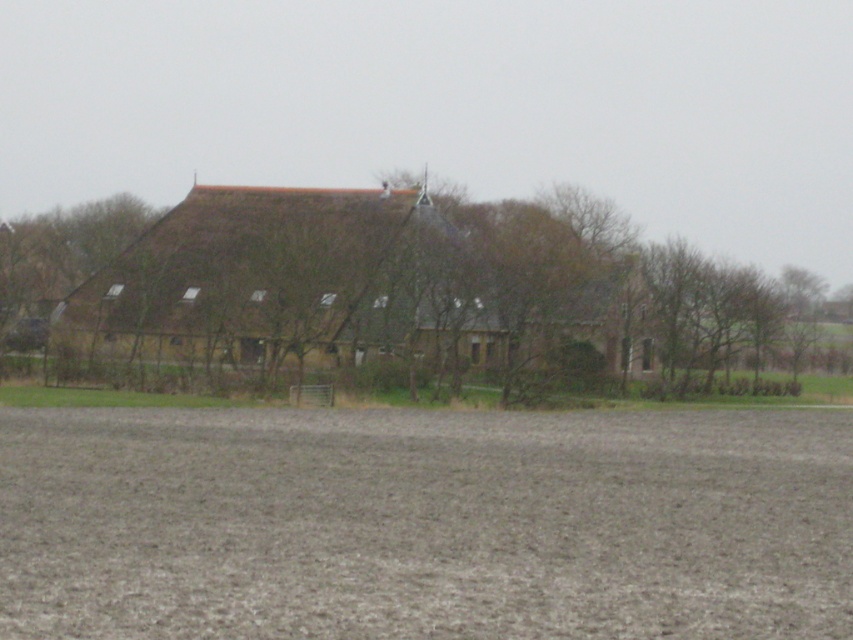
Question: Among these points, which one is farthest from the camera?

Choices:
 (A) (93, 273)
 (B) (485, 456)

Answer: (A)

Question: Can you confirm if brown soil at lower center is smaller than brown thatched roof at center?

Choices:
 (A) no
 (B) yes

Answer: (B)

Question: Is the position of brown soil at lower center less distant than that of brown thatched roof at center?

Choices:
 (A) yes
 (B) no

Answer: (A)

Question: Which point appears farthest from the camera in this image?

Choices:
 (A) (402, 195)
 (B) (645, 419)

Answer: (A)

Question: Can you confirm if brown soil at lower center is positioned to the right of brown thatched roof at center?

Choices:
 (A) no
 (B) yes

Answer: (A)

Question: Among these points, which one is nearest to the camera?

Choices:
 (A) (648, 628)
 (B) (477, 296)

Answer: (A)